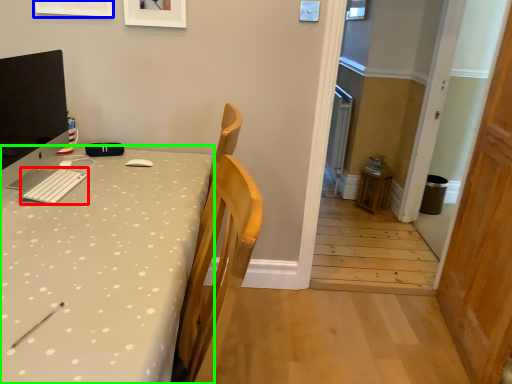
Question: Estimate the real-world distances between objects in this image. Which object is closer to keyboard (highlighted by a red box), picture frame (highlighted by a blue box) or desk (highlighted by a green box)?

Choices:
 (A) picture frame
 (B) desk

Answer: (B)